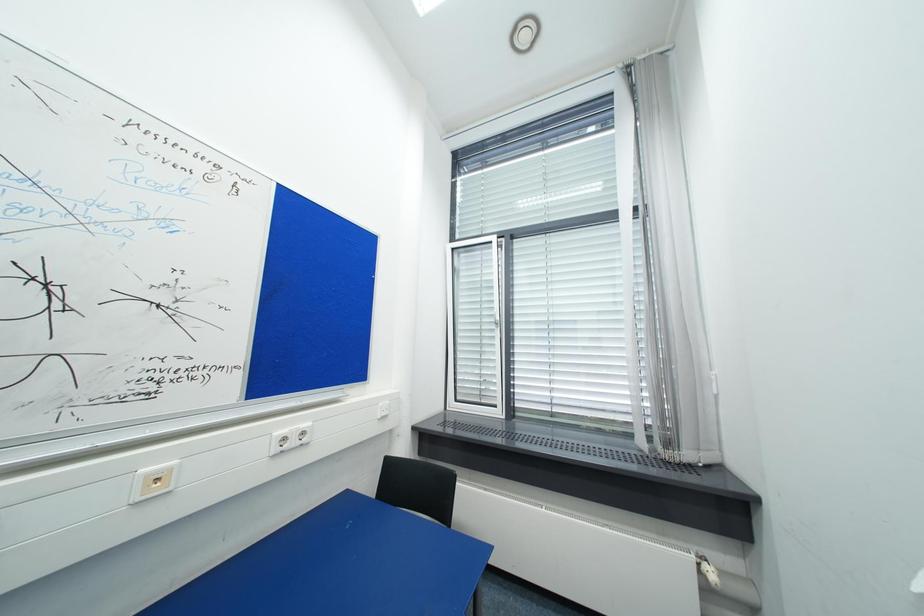
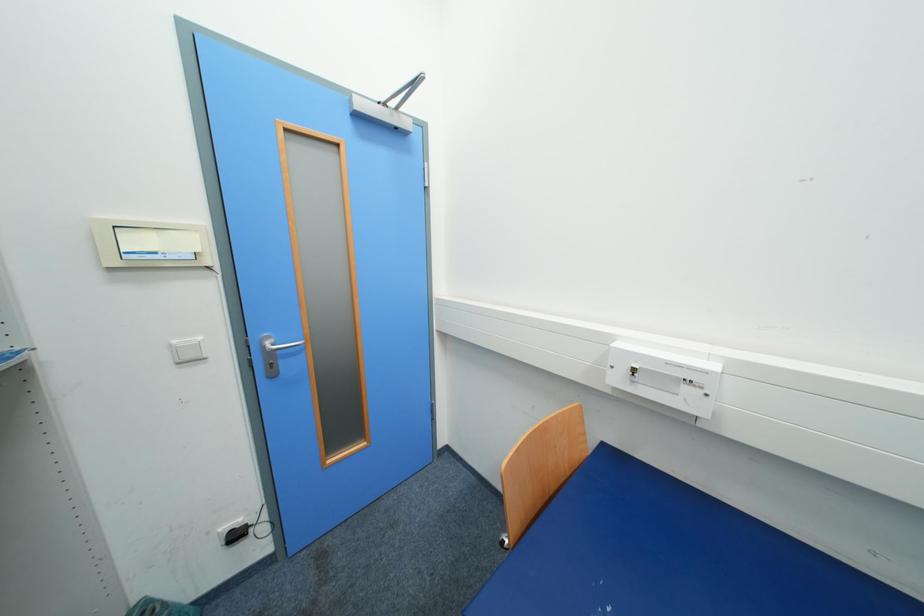
Question: The camera is either moving clockwise (left) or counter-clockwise (right) around the object. The first image is from the beginning of the video and the second image is from the end. Is the camera moving left or right when shooting the video?

Choices:
 (A) Left
 (B) Right

Answer: (B)